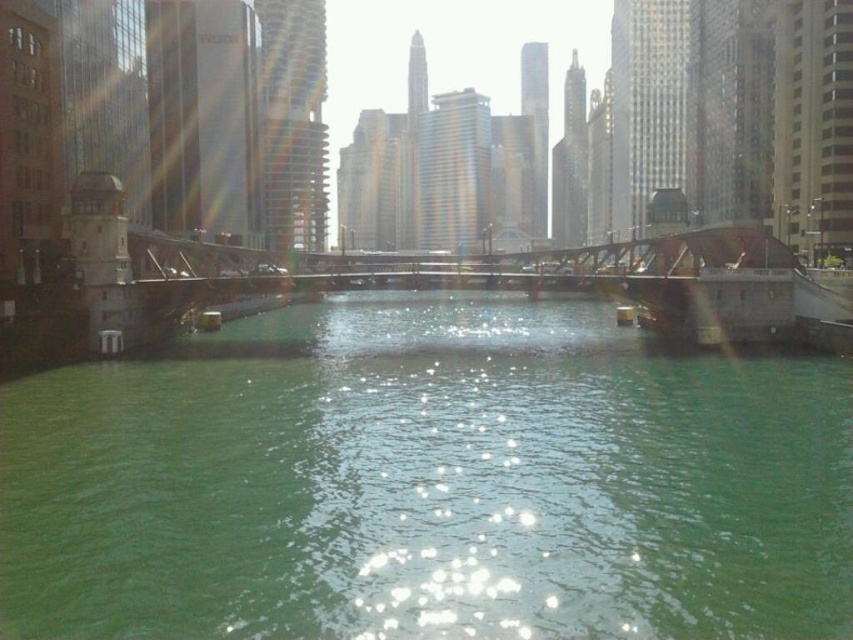
Question: Observing the image, what is the correct spatial positioning of metallic bridge at center in reference to metallic brown bridge at right?

Choices:
 (A) above
 (B) below

Answer: (A)

Question: Which object appears farthest from the camera in this image?

Choices:
 (A) metallic brown bridge at right
 (B) green water at center
 (C) metallic bridge at center

Answer: (C)

Question: Is metallic bridge at center to the left of metallic brown bridge at right from the viewer's perspective?

Choices:
 (A) yes
 (B) no

Answer: (A)

Question: Does metallic bridge at center lie in front of metallic brown bridge at right?

Choices:
 (A) yes
 (B) no

Answer: (B)

Question: Which is nearer to the metallic bridge at center?

Choices:
 (A) metallic brown bridge at right
 (B) green water at center

Answer: (A)

Question: Which object is positioned farthest from the metallic bridge at center?

Choices:
 (A) green water at center
 (B) metallic brown bridge at right

Answer: (A)